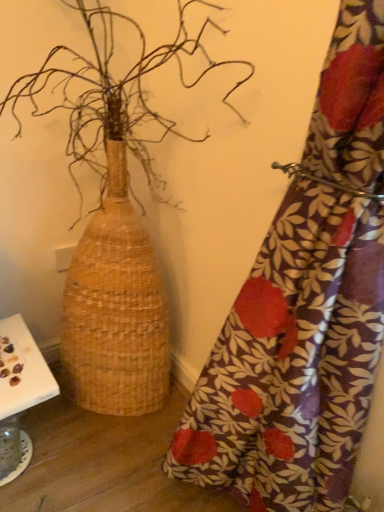
Image resolution: width=384 pixels, height=512 pixels. What do you see at coordinates (115, 216) in the screenshot? I see `natural woven basket at left` at bounding box center [115, 216].

You are a GUI agent. You are given a task and a screenshot of the screen. Output one action in this format:
    pyautogui.click(x=<x>, y=<y>)
    Task: Click on the natural woven basket at left
    The image size is (384, 512).
    Given the screenshot: What is the action you would take?
    pyautogui.click(x=115, y=216)

What's the angular difference between white paper at lower left and natural woven basket at left's facing directions?

The facing directions of white paper at lower left and natural woven basket at left are 0.391 degrees apart.

Is point (23, 457) closer to viewer compared to point (64, 292)?

Yes, it is in front of point (64, 292).

From the image's perspective, between white paper at lower left and natural woven basket at left, which one is located above?

From the image's view, natural woven basket at left is above.

How many degrees apart are the facing directions of natural woven basket at left and floral fabric curtain at right?

They differ by 88.3 degrees in their facing directions.

Is natural woven basket at left directly adjacent to floral fabric curtain at right?

They are not placed beside each other.

Is natural woven basket at left spatially inside floral fabric curtain at right, or outside of it?

natural woven basket at left lies outside floral fabric curtain at right.

Is natural woven basket at left positioned in front of floral fabric curtain at right?

No, natural woven basket at left is further to the viewer.

Considering the sizes of objects natural woven basket at left and white paper at lower left in the image provided, who is wider, natural woven basket at left or white paper at lower left?

With larger width is natural woven basket at left.

Is natural woven basket at left next to white paper at lower left?

No, natural woven basket at left is not with white paper at lower left.

Who is more distant, natural woven basket at left or white paper at lower left?

white paper at lower left is more distant.

From the image's perspective, is natural woven basket at left over white paper at lower left?

Indeed, from the image's perspective, natural woven basket at left is shown above white paper at lower left.

Is floral fabric curtain at right positioned beyond the bounds of natural woven basket at left?

That's correct, floral fabric curtain at right is outside of natural woven basket at left.

Can you confirm if floral fabric curtain at right is shorter than natural woven basket at left?

Correct, floral fabric curtain at right is not as tall as natural woven basket at left.

Considering the relative sizes of floral fabric curtain at right and natural woven basket at left in the image provided, is floral fabric curtain at right smaller than natural woven basket at left?

Indeed, floral fabric curtain at right has a smaller size compared to natural woven basket at left.

From the picture: Considering the relative positions of floral fabric curtain at right and natural woven basket at left in the image provided, is floral fabric curtain at right in front of natural woven basket at left?

Yes, the depth of floral fabric curtain at right is less than that of natural woven basket at left.

Is there a large distance between floral fabric curtain at right and white paper at lower left?

They are positioned close to each other.

This screenshot has height=512, width=384. Identify the location of curtain above the white paper at lower left (from the image's perspective). (304, 309).

Does floral fabric curtain at right come behind white paper at lower left?

No, it is in front of white paper at lower left.

Is floral fabric curtain at right not within white paper at lower left?

Indeed, floral fabric curtain at right is completely outside white paper at lower left.

Visually, is white paper at lower left positioned to the left or to the right of floral fabric curtain at right?

white paper at lower left is positioned on floral fabric curtain at right's left side.

Is white paper at lower left in front of or behind floral fabric curtain at right in the image?

In the image, white paper at lower left appears behind floral fabric curtain at right.

Considering the relative sizes of white paper at lower left and floral fabric curtain at right in the image provided, is white paper at lower left taller than floral fabric curtain at right?

In fact, white paper at lower left may be shorter than floral fabric curtain at right.

Is white paper at lower left facing towards floral fabric curtain at right?

No, white paper at lower left is not turned towards floral fabric curtain at right.

Where is `houseplant in front of the white paper at lower left`? houseplant in front of the white paper at lower left is located at coordinates (115, 216).

You are a GUI agent. You are given a task and a screenshot of the screen. Output one action in this format:
    pyautogui.click(x=<x>, y=<y>)
    Task: Click on the houseplant above the floral fabric curtain at right (from the image's perspective)
    This screenshot has width=384, height=512.
    Given the screenshot: What is the action you would take?
    pyautogui.click(x=115, y=216)

Considering their positions, is floral fabric curtain at right positioned further to natural woven basket at left than white paper at lower left?

Among the two, floral fabric curtain at right is located further to natural woven basket at left.

Estimate the real-world distances between objects in this image. Which object is further from white paper at lower left, floral fabric curtain at right or natural woven basket at left?

floral fabric curtain at right lies further to white paper at lower left than the other object.

When comparing their distances from natural woven basket at left, does white paper at lower left or floral fabric curtain at right seem further?

floral fabric curtain at right.

Looking at the image, which one is located further to floral fabric curtain at right, white paper at lower left or natural woven basket at left?

white paper at lower left is positioned further to the anchor floral fabric curtain at right.

Consider the image. Which object lies nearer to the anchor point floral fabric curtain at right, natural woven basket at left or white paper at lower left?

Among the two, natural woven basket at left is located nearer to floral fabric curtain at right.

Based on their spatial positions, is natural woven basket at left or floral fabric curtain at right further from white paper at lower left?

Among the two, floral fabric curtain at right is located further to white paper at lower left.

Image resolution: width=384 pixels, height=512 pixels. In order to click on houseplant situated between white paper at lower left and floral fabric curtain at right from left to right in this screenshot , I will do `click(115, 216)`.